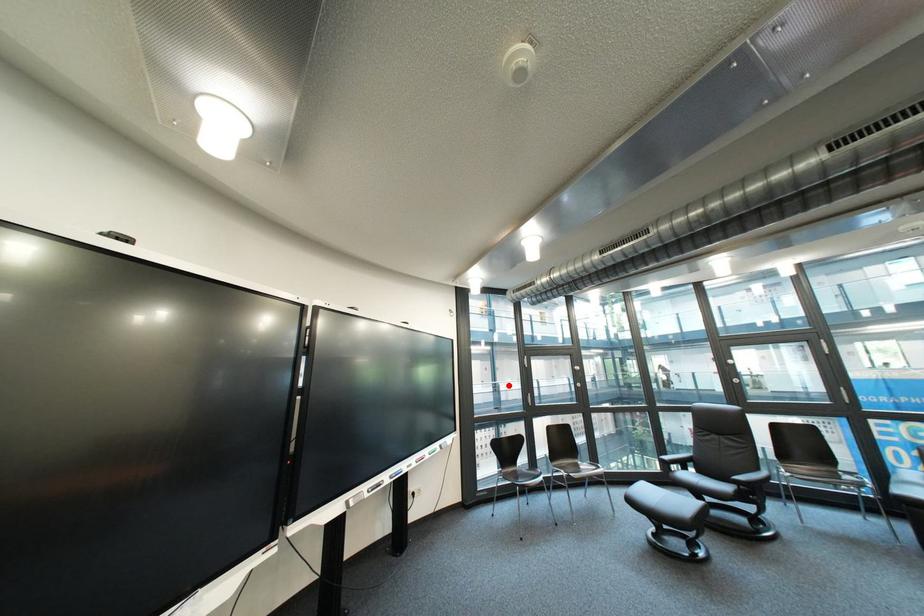
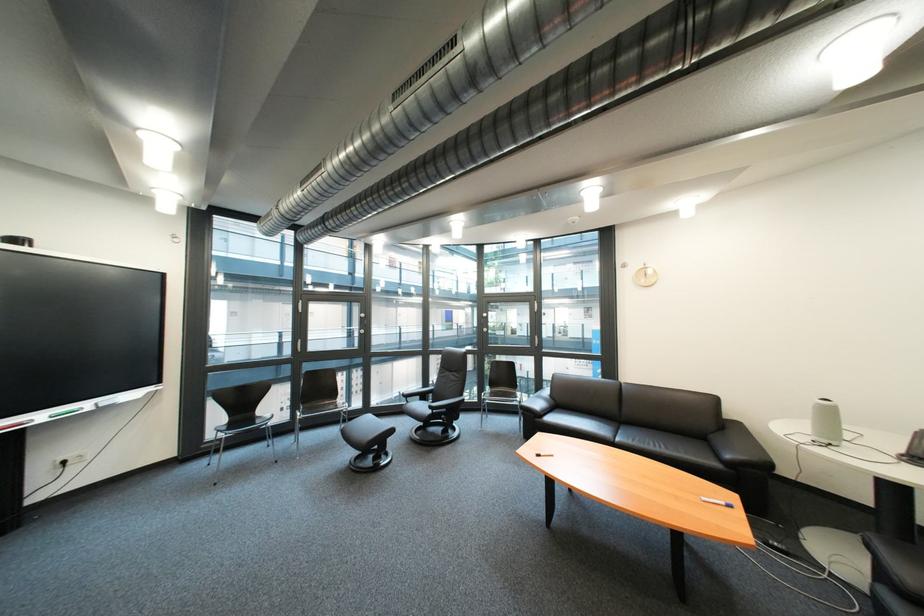
Question: A red point is marked in image1. In image2, is the corresponding 3D point closer to the camera or farther? Reply with the corresponding letter.

Choices:
 (A) The corresponding 3D point is closer.
 (B) The corresponding 3D point is farther.

Answer: (A)